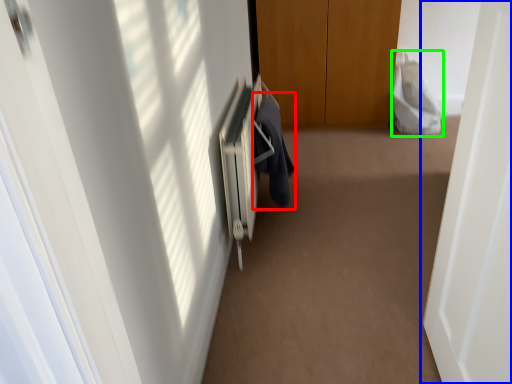
Question: Which is farther away from robe (highlighted by a red box)? door (highlighted by a blue box) or robe (highlighted by a green box)?

Choices:
 (A) door
 (B) robe

Answer: (B)